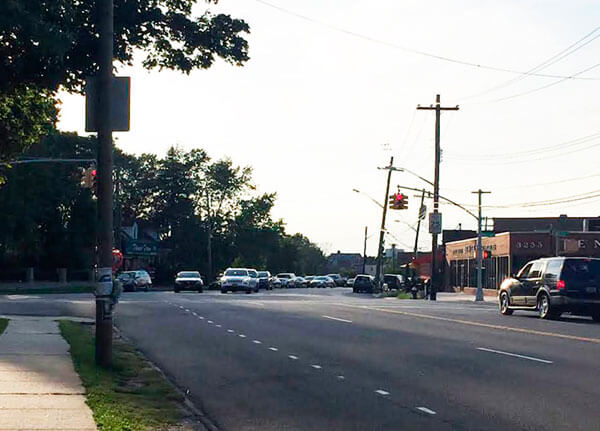
I want to click on homes, so click(x=140, y=251), click(x=343, y=257).